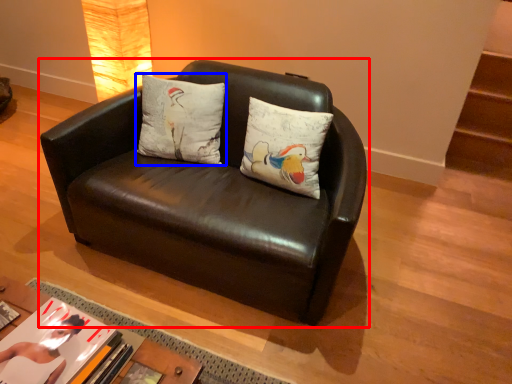
Question: Which object is further to the camera taking this photo, studio couch (highlighted by a red box) or pillow (highlighted by a blue box)?

Choices:
 (A) studio couch
 (B) pillow

Answer: (B)